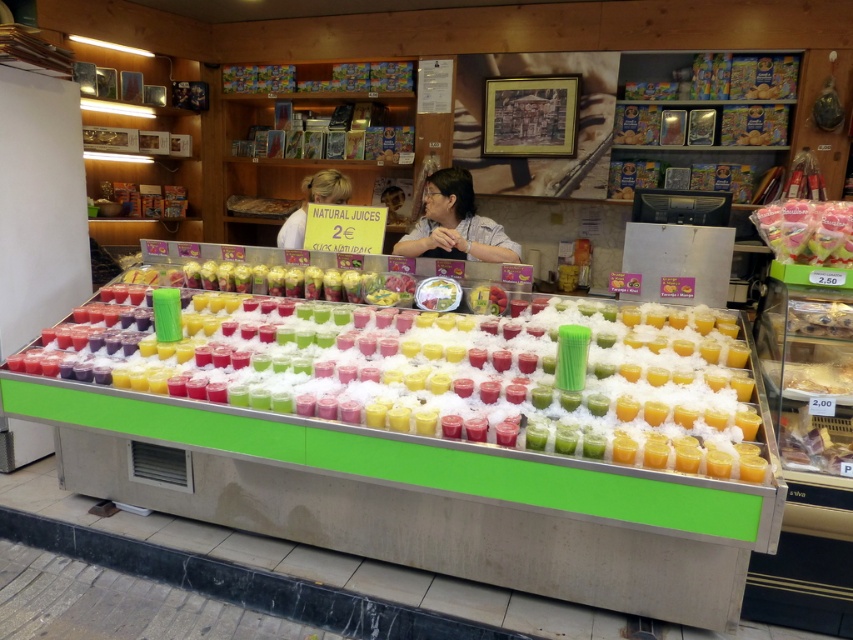
Is translucent plastic candy at upper right bigger than translucent plastic bag at lower right?

Indeed, translucent plastic candy at upper right has a larger size compared to translucent plastic bag at lower right.

Is translucent plastic candy at upper right positioned behind translucent plastic bag at lower right?

Yes, translucent plastic candy at upper right is further from the viewer.

Locate an element on the screen. This screenshot has height=640, width=853. translucent plastic candy at upper right is located at coordinates (807, 230).

Who is more distant from viewer, (454, 173) or (776, 252)?

The point (454, 173) is behind.

You are a GUI agent. You are given a task and a screenshot of the screen. Output one action in this format:
    pyautogui.click(x=<x>, y=<y>)
    Task: Click on the matte gray shirt at center
    The image size is (853, 640).
    Given the screenshot: What is the action you would take?
    pyautogui.click(x=454, y=224)

I want to click on matte gray shirt at center, so click(454, 224).

Does translucent plastic bag at lower right have a lesser width compared to smooth white shirt at center?

Yes.

Can you confirm if translucent plastic bag at lower right is taller than smooth white shirt at center?

No, translucent plastic bag at lower right is not taller than smooth white shirt at center.

Locate an element on the screen. Image resolution: width=853 pixels, height=640 pixels. translucent plastic bag at lower right is located at coordinates (815, 445).

Locate an element on the screen. translucent plastic bag at lower right is located at coordinates (815, 445).